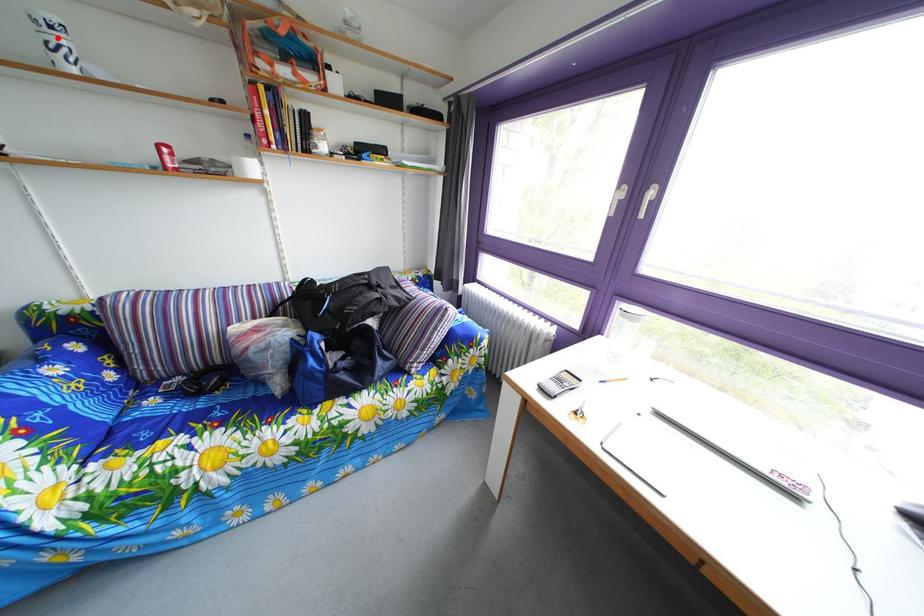
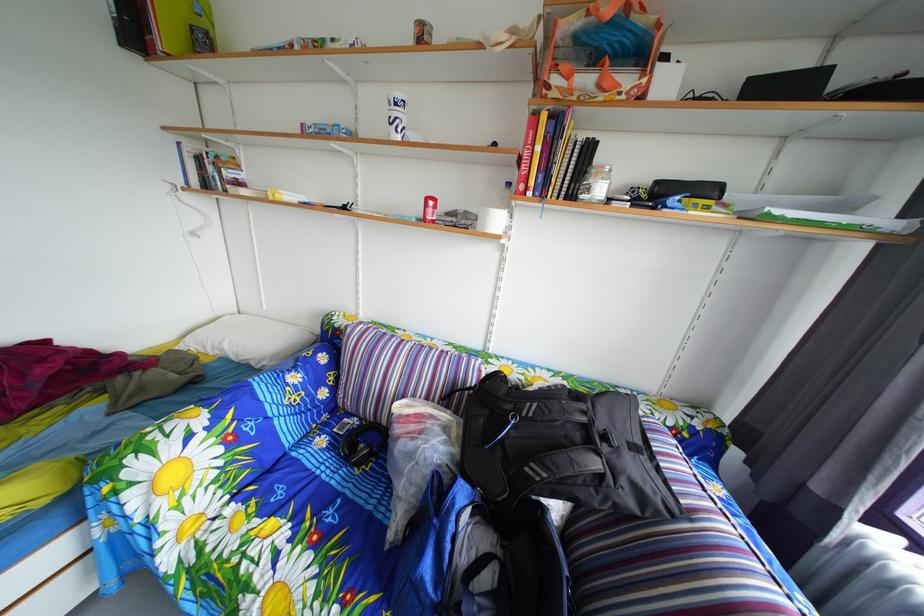
Question: I am providing you with two images of the same scene from different viewpoints. Image1 has a red point marked. In image2, the corresponding 3D location appears at what relative position? Reply with the corresponding letter.

Choices:
 (A) Closer
 (B) Farther

Answer: (A)